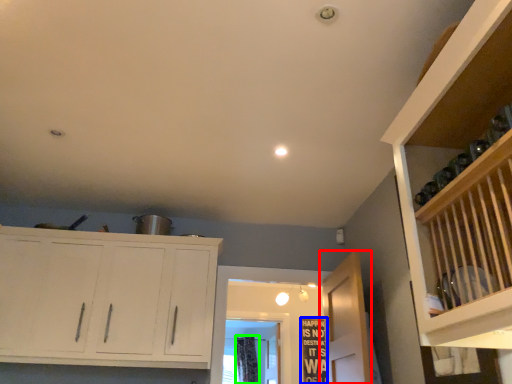
Question: Estimate the real-world distances between objects in this image. Which object is farther from door (highlighted by a red box), bulletin board (highlighted by a blue box) or curtain (highlighted by a green box)?

Choices:
 (A) bulletin board
 (B) curtain

Answer: (B)